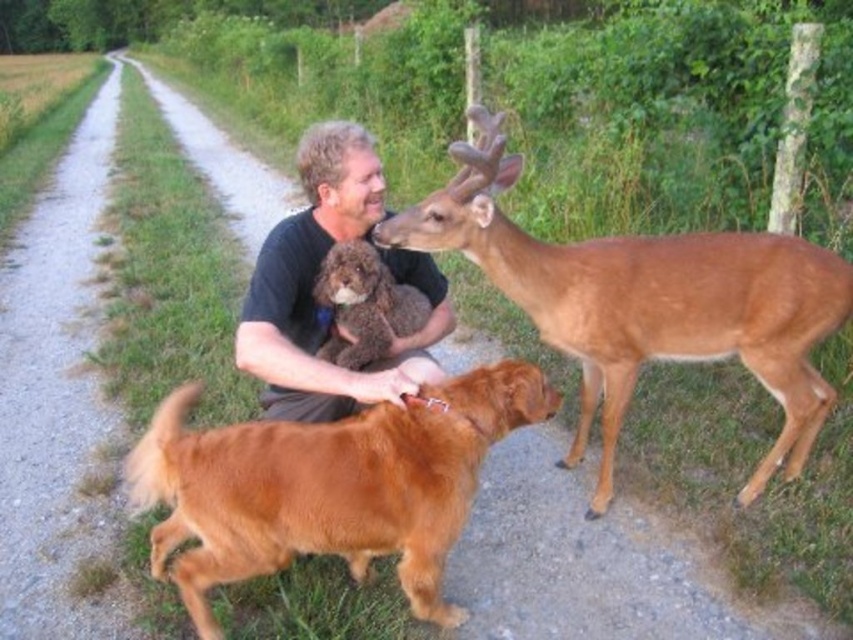
Question: Considering the relative positions of black cotton shirt at center and brown plush toy at center in the image provided, where is black cotton shirt at center located with respect to brown plush toy at center?

Choices:
 (A) right
 (B) left

Answer: (B)

Question: Which object is positioned farthest from the black cotton shirt at center?

Choices:
 (A) brown matte/deer at center
 (B) golden fur dog at center
 (C) brown plush toy at center

Answer: (A)

Question: In this image, where is golden fur dog at center located relative to brown plush toy at center?

Choices:
 (A) below
 (B) above

Answer: (A)

Question: Observing the image, what is the correct spatial positioning of brown matte/deer at center in reference to golden fur dog at center?

Choices:
 (A) above
 (B) below

Answer: (A)

Question: Which of the following is the farthest from the observer?

Choices:
 (A) (711, 256)
 (B) (294, 253)
 (C) (294, 508)
 (D) (386, 339)

Answer: (A)

Question: Which of the following is the farthest from the observer?

Choices:
 (A) (418, 540)
 (B) (274, 234)
 (C) (502, 230)

Answer: (C)